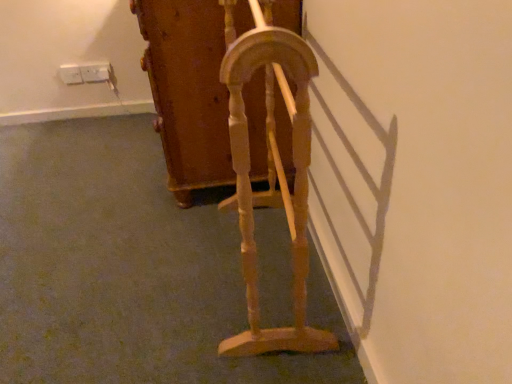
Question: Which direction should I rotate to look at wooden cabinet at center, the 2th furniture viewed from the front?

Choices:
 (A) left
 (B) right

Answer: (A)

Question: Would you say white plastic electric outlet at upper left, placed as the 1th electric outlet when sorted from left to right, is part of white plastic electric outlet at upper left, positioned as the 2th electric outlet in left-to-right order,'s contents?

Choices:
 (A) yes
 (B) no

Answer: (B)

Question: Is white plastic electric outlet at upper left, positioned as the 2th electric outlet in left-to-right order, further to the viewer compared to white plastic electric outlet at upper left, arranged as the 2th electric outlet when viewed from the right?

Choices:
 (A) yes
 (B) no

Answer: (A)

Question: From a real-world perspective, is white plastic electric outlet at upper left, positioned as the 2th electric outlet in left-to-right order, physically below white plastic electric outlet at upper left, arranged as the 2th electric outlet when viewed from the right?

Choices:
 (A) no
 (B) yes

Answer: (B)

Question: Is white plastic electric outlet at upper left, positioned as the first electric outlet in right-to-left order, wider than white plastic electric outlet at upper left, arranged as the 2th electric outlet when viewed from the right?

Choices:
 (A) yes
 (B) no

Answer: (A)

Question: Considering the relative sizes of white plastic electric outlet at upper left, positioned as the first electric outlet in right-to-left order, and white plastic electric outlet at upper left, arranged as the 2th electric outlet when viewed from the right, in the image provided, is white plastic electric outlet at upper left, positioned as the first electric outlet in right-to-left order, shorter than white plastic electric outlet at upper left, arranged as the 2th electric outlet when viewed from the right,?

Choices:
 (A) yes
 (B) no

Answer: (A)

Question: Is white plastic electric outlet at upper left, positioned as the 2th electric outlet in left-to-right order, to the right of white plastic electric outlet at upper left, placed as the 1th electric outlet when sorted from left to right, from the viewer's perspective?

Choices:
 (A) no
 (B) yes

Answer: (B)

Question: From a real-world perspective, is white plastic electric outlet at upper left, arranged as the 2th electric outlet when viewed from the right, over light wood/woodenobject at center, the 1th furniture when ordered from front to back?

Choices:
 (A) no
 (B) yes

Answer: (A)

Question: Does white plastic electric outlet at upper left, arranged as the 2th electric outlet when viewed from the right, have a lesser height compared to light wood/woodenobject at center, which is counted as the 2th furniture, starting from the back?

Choices:
 (A) no
 (B) yes

Answer: (B)

Question: Is white plastic electric outlet at upper left, placed as the 1th electric outlet when sorted from left to right, outside light wood/woodenobject at center, which is counted as the 2th furniture, starting from the back?

Choices:
 (A) yes
 (B) no

Answer: (A)

Question: From the image's perspective, is white plastic electric outlet at upper left, arranged as the 2th electric outlet when viewed from the right, on light wood/woodenobject at center, which is counted as the 2th furniture, starting from the back?

Choices:
 (A) yes
 (B) no

Answer: (A)

Question: Can you confirm if white plastic electric outlet at upper left, placed as the 1th electric outlet when sorted from left to right, is thinner than light wood/woodenobject at center, which is counted as the 2th furniture, starting from the back?

Choices:
 (A) no
 (B) yes

Answer: (B)

Question: Can you see white plastic electric outlet at upper left, placed as the 1th electric outlet when sorted from left to right, touching light wood/woodenobject at center, the 1th furniture when ordered from front to back?

Choices:
 (A) no
 (B) yes

Answer: (A)

Question: From the image's perspective, is white plastic electric outlet at upper left, arranged as the 2th electric outlet when viewed from the right, on top of wooden cabinet at center, positioned as the first furniture in back-to-front order?

Choices:
 (A) yes
 (B) no

Answer: (A)